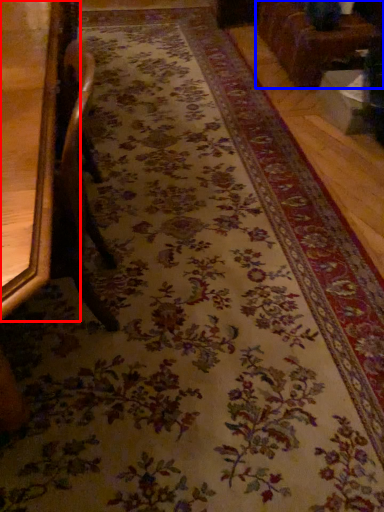
Question: Among these objects, which one is farthest to the camera, furniture (highlighted by a red box) or furniture (highlighted by a blue box)?

Choices:
 (A) furniture
 (B) furniture

Answer: (B)